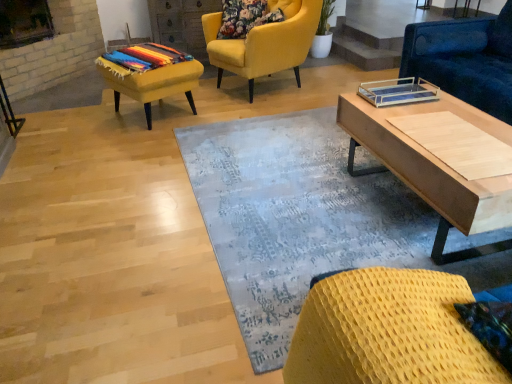
Question: Is velvet yellow armchair at upper center, arranged as the 1th chair when viewed from the left, oriented towards light wood coffee table at right?

Choices:
 (A) no
 (B) yes

Answer: (A)

Question: From a real-world perspective, is velvet yellow armchair at upper center, the 3th chair from the right, positioned over light wood coffee table at right based on gravity?

Choices:
 (A) no
 (B) yes

Answer: (B)

Question: Can you confirm if velvet yellow armchair at upper center, arranged as the 1th chair when viewed from the left, is thinner than light wood coffee table at right?

Choices:
 (A) no
 (B) yes

Answer: (A)

Question: Does velvet yellow armchair at upper center, which is the first chair from back to front, contain light wood coffee table at right?

Choices:
 (A) no
 (B) yes

Answer: (A)

Question: From a real-world perspective, is velvet yellow armchair at upper center, the 3th chair from the right, positioned under light wood coffee table at right based on gravity?

Choices:
 (A) no
 (B) yes

Answer: (A)

Question: Considering the positions of blue fabric couch at upper right, the 2th chair positioned from the back, and blue textured rug at center in the image, is blue fabric couch at upper right, the 2th chair positioned from the back, taller or shorter than blue textured rug at center?

Choices:
 (A) short
 (B) tall

Answer: (B)

Question: Is point (470, 74) closer or farther from the camera than point (206, 221)?

Choices:
 (A) farther
 (B) closer

Answer: (A)

Question: Would you say blue fabric couch at upper right, the 2th chair viewed from the front, is to the left or to the right of blue textured rug at center in the picture?

Choices:
 (A) right
 (B) left

Answer: (A)

Question: Which is correct: blue fabric couch at upper right, the 2th chair viewed from the front, is inside blue textured rug at center, or outside of it?

Choices:
 (A) inside
 (B) outside

Answer: (B)

Question: Looking at the image, does multicolored woven blanket at left seem bigger or smaller compared to light wood coffee table at right?

Choices:
 (A) big
 (B) small

Answer: (B)

Question: In the image, is multicolored woven blanket at left positioned in front of or behind light wood coffee table at right?

Choices:
 (A) behind
 (B) front

Answer: (A)

Question: From a real-world perspective, is multicolored woven blanket at left positioned above or below light wood coffee table at right?

Choices:
 (A) below
 (B) above

Answer: (B)

Question: In terms of width, does multicolored woven blanket at left look wider or thinner when compared to light wood coffee table at right?

Choices:
 (A) thin
 (B) wide

Answer: (B)

Question: Is blue fabric couch at upper right, the 2th chair positioned from the back, wider or thinner than woven yellow chair at lower right, which ranks as the second chair in left-to-right order?

Choices:
 (A) thin
 (B) wide

Answer: (B)

Question: From a real-world perspective, is blue fabric couch at upper right, the 2th chair positioned from the back, above or below woven yellow chair at lower right, marked as the second chair in a right-to-left arrangement?

Choices:
 (A) below
 (B) above

Answer: (A)